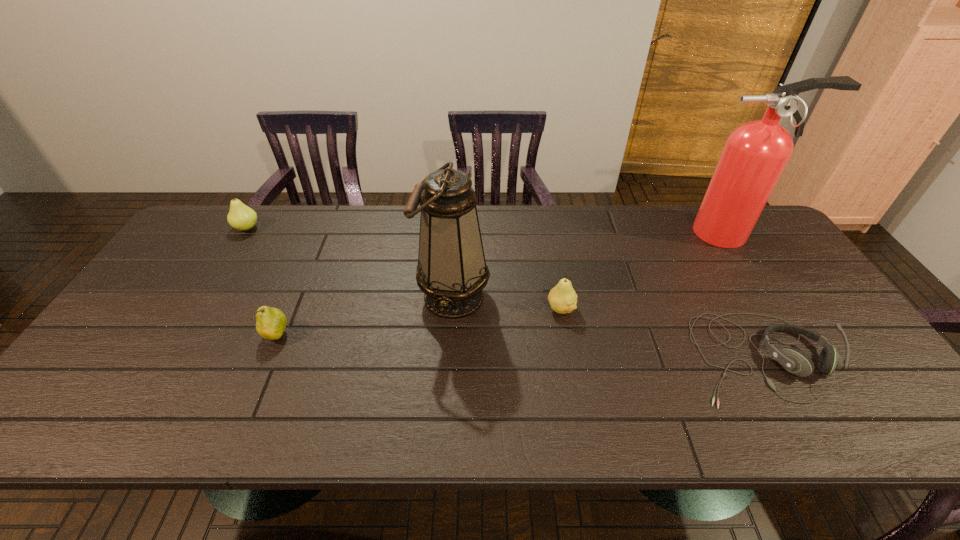
The image size is (960, 540). I want to click on free spot between the third object from right to left and the fourth object from right to left, so click(507, 302).

The image size is (960, 540). I want to click on vacant area between the third object from right to left and the tallest object, so click(645, 271).

Image resolution: width=960 pixels, height=540 pixels. I want to click on empty location between the rightmost pear and the third object from left to right, so click(x=507, y=302).

Locate an element on the screen. The height and width of the screenshot is (540, 960). vacant space that is in between the nearest pear and the fire extinguisher is located at coordinates (503, 284).

Image resolution: width=960 pixels, height=540 pixels. Find the location of `empty space that is in between the fire extinguisher and the nearest pear`. empty space that is in between the fire extinguisher and the nearest pear is located at coordinates (503, 284).

At what (x,y) coordinates should I click in order to perform the action: click on free point between the fire extinguisher and the shortest object. Please return your answer as a coordinate pair (x, y). Image resolution: width=960 pixels, height=540 pixels. Looking at the image, I should click on (745, 295).

Image resolution: width=960 pixels, height=540 pixels. What are the coordinates of `free spot between the oil lamp and the fifth object from right to left` in the screenshot? It's located at click(x=365, y=316).

Where is `free space between the nearest pear and the shortest object`? The width and height of the screenshot is (960, 540). free space between the nearest pear and the shortest object is located at coordinates (518, 346).

The height and width of the screenshot is (540, 960). I want to click on the fifth closest object relative to the fire extinguisher, so click(241, 217).

Identify the location of object that is the second closest to the fifth object from right to left. (241, 217).